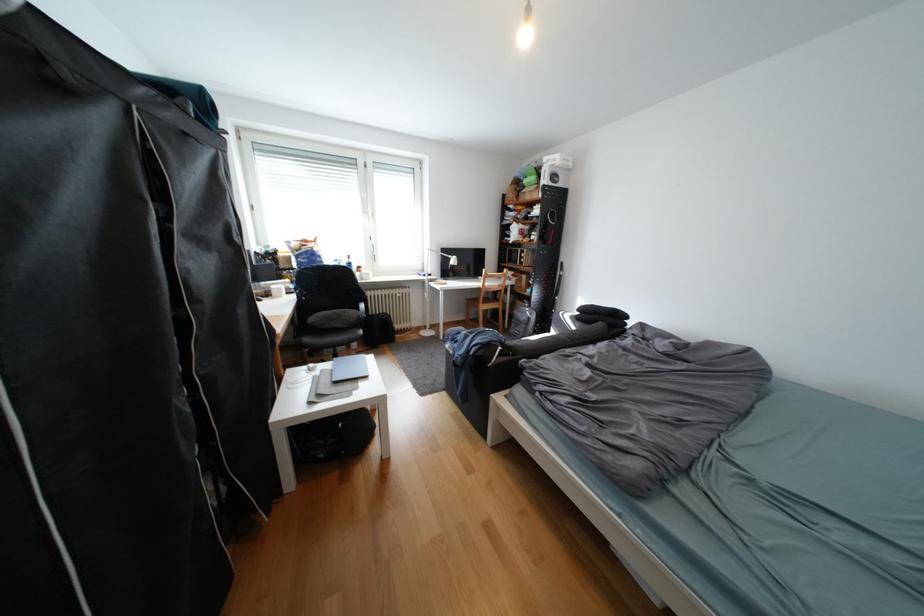
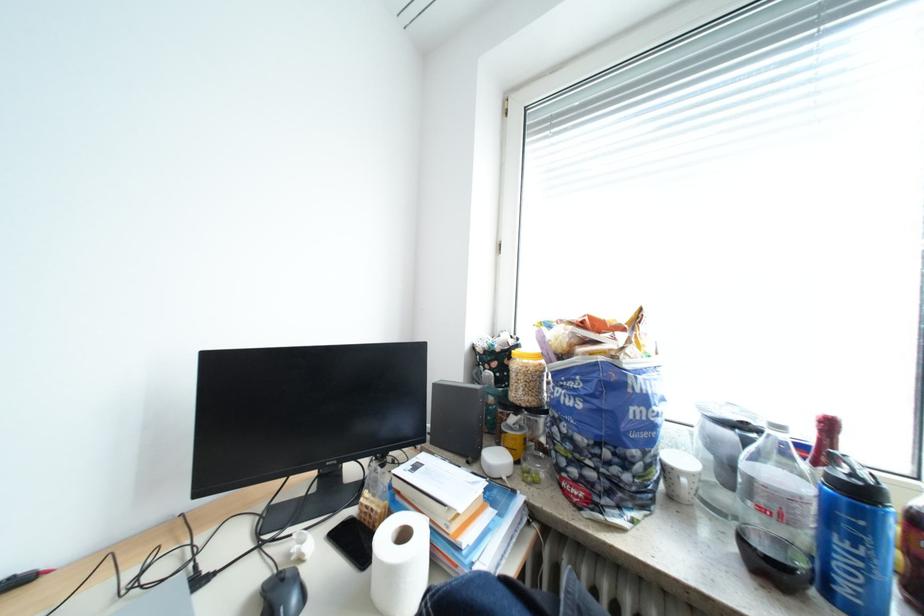
In the second image, find the point that corresponds to (x=296, y=267) in the first image.

(529, 394)